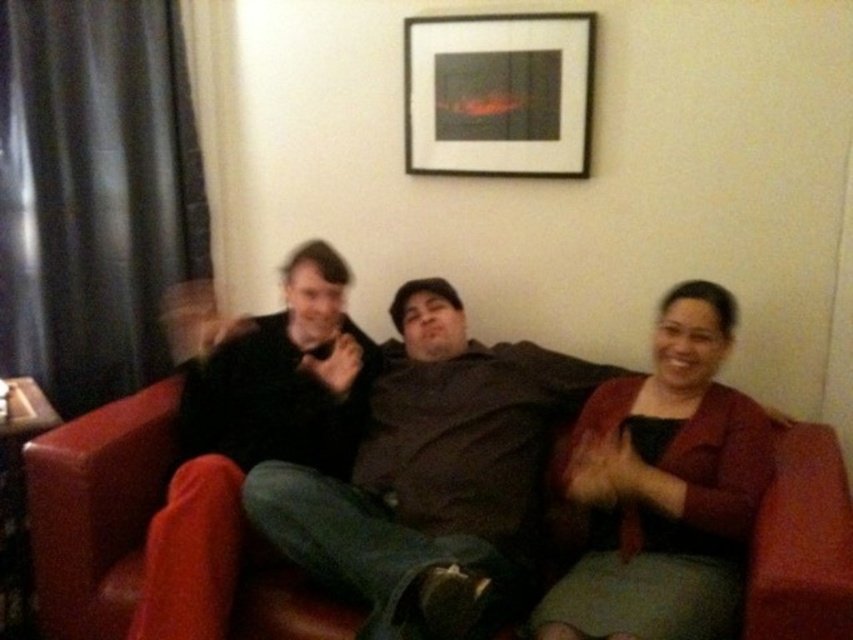
Question: Is matte red sweater at center to the right of matte black jacket at center from the viewer's perspective?

Choices:
 (A) no
 (B) yes

Answer: (B)

Question: Is dark brown sweater at center positioned in front of matte black jacket at center?

Choices:
 (A) no
 (B) yes

Answer: (B)

Question: Which of these objects is positioned closest to the dark brown sweater at center?

Choices:
 (A) black matte picture frame at upper center
 (B) matte black jacket at center

Answer: (B)

Question: Which of the following is the farthest from the observer?

Choices:
 (A) black matte picture frame at upper center
 (B) dark brown sweater at center
 (C) matte red sweater at center
 (D) matte black jacket at center

Answer: (A)

Question: Does matte red sweater at center appear under matte black jacket at center?

Choices:
 (A) yes
 (B) no

Answer: (A)

Question: Which of the following is the closest to the observer?

Choices:
 (A) dark brown sweater at center
 (B) black matte picture frame at upper center

Answer: (A)